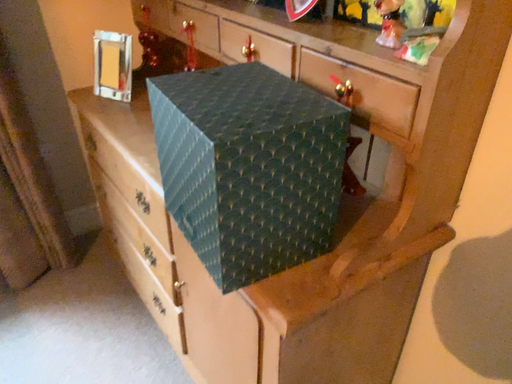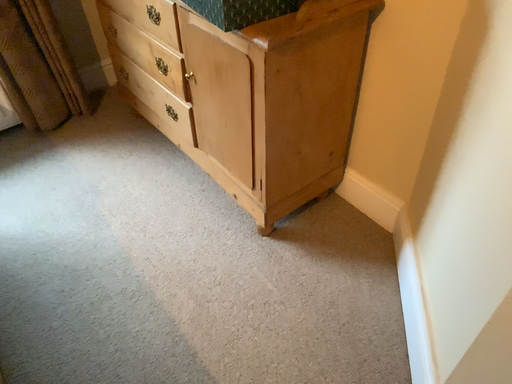
Question: How did the camera likely rotate when shooting the video?

Choices:
 (A) rotated downward
 (B) rotated upward

Answer: (A)